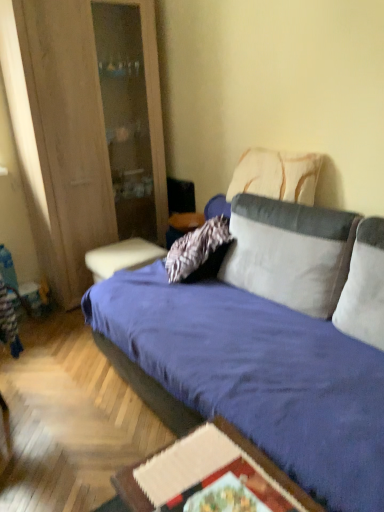
What do you see at coordinates (290, 252) in the screenshot? This screenshot has height=512, width=384. I see `velvety white pillow at center, the 2th pillow when ordered from front to back` at bounding box center [290, 252].

Where is `wooden textured table at lower center, the second table when ordered from back to front`? The image size is (384, 512). wooden textured table at lower center, the second table when ordered from back to front is located at coordinates pos(209,471).

This screenshot has width=384, height=512. What do you see at coordinates (364, 286) in the screenshot?
I see `white soft pillow at right, which is the first pillow from front to back` at bounding box center [364, 286].

The width and height of the screenshot is (384, 512). Describe the element at coordinates (80, 133) in the screenshot. I see `wooden cabinet at left` at that location.

What is the approximate width of velvet blue studio couch at center?

The width of velvet blue studio couch at center is 1.08 meters.

The width and height of the screenshot is (384, 512). Describe the element at coordinates (269, 345) in the screenshot. I see `velvet blue studio couch at center` at that location.

This screenshot has height=512, width=384. Identify the location of white textured pillow at upper right, the 1th pillow viewed from the back. (276, 176).

Where is `matte blue table at center, the second table when ordered from bottom to top`? Image resolution: width=384 pixels, height=512 pixels. matte blue table at center, the second table when ordered from bottom to top is located at coordinates (122, 257).

Which is closer to the camera, (x=244, y=247) or (x=163, y=469)?

The point (x=163, y=469) is in front.

In the scene shown: Are velvet blue studio couch at center and wooden textured table at lower center, the second table when ordered from back to front, located far from each other?

velvet blue studio couch at center is actually quite close to wooden textured table at lower center, the second table when ordered from back to front.

From the image's perspective, does velvet blue studio couch at center appear higher than wooden textured table at lower center, the first table from the front?

Indeed, from the image's perspective, velvet blue studio couch at center is shown above wooden textured table at lower center, the first table from the front.

Would you say wooden textured table at lower center, arranged as the first table when ordered from the bottom, is part of velvet blue studio couch at center's contents?

No, wooden textured table at lower center, arranged as the first table when ordered from the bottom, is located outside of velvet blue studio couch at center.

Who is taller, velvet blue studio couch at center or velvety white pillow at center, the 2th pillow when ordered from front to back?

velvet blue studio couch at center is taller.

From the image's perspective, is velvet blue studio couch at center beneath velvety white pillow at center, the 2th pillow when ordered from front to back?

Yes.

Relative to velvety white pillow at center, acting as the second pillow starting from the back, is velvet blue studio couch at center in front or behind?

velvet blue studio couch at center is in front of velvety white pillow at center, acting as the second pillow starting from the back.

Is velvet blue studio couch at center turned away from velvety white pillow at center, the 2th pillow when ordered from front to back?

That's right, velvet blue studio couch at center is facing away from velvety white pillow at center, the 2th pillow when ordered from front to back.

Which is behind, point (266, 165) or point (290, 269)?

The point (266, 165) is farther.

Can you confirm if white textured pillow at upper right, the 1th pillow viewed from the back, is positioned to the right of velvety white pillow at center, acting as the second pillow starting from the back?

In fact, white textured pillow at upper right, the 1th pillow viewed from the back, is to the left of velvety white pillow at center, acting as the second pillow starting from the back.

From their relative heights in the image, would you say white textured pillow at upper right, which ranks as the third pillow in front-to-back order, is taller or shorter than velvety white pillow at center, the 2th pillow when ordered from front to back?

In the image, white textured pillow at upper right, which ranks as the third pillow in front-to-back order, appears to be shorter than velvety white pillow at center, the 2th pillow when ordered from front to back.

Is white textured pillow at upper right, the 1th pillow viewed from the back, directly adjacent to velvety white pillow at center, the 2th pillow when ordered from front to back?

white textured pillow at upper right, the 1th pillow viewed from the back, and velvety white pillow at center, the 2th pillow when ordered from front to back, are clearly separated.

Based on the photo, does velvety white pillow at center, acting as the second pillow starting from the back, have a lesser width compared to velvet blue studio couch at center?

Indeed, velvety white pillow at center, acting as the second pillow starting from the back, has a lesser width compared to velvet blue studio couch at center.

Starting from the velvet blue studio couch at center, which pillow is the 2nd one behind? Please provide its 2D coordinates.

[(290, 252)]

Who is smaller, velvety white pillow at center, acting as the second pillow starting from the back, or velvet blue studio couch at center?

velvety white pillow at center, acting as the second pillow starting from the back, is smaller.

Which is in front, point (236, 241) or point (271, 439)?

Point (271, 439)

Is white soft pillow at right, which is the first pillow from front to back, not near velvety white pillow at center, acting as the second pillow starting from the back?

No.

Does white soft pillow at right, which is the first pillow from front to back, turn towards velvety white pillow at center, the 2th pillow when ordered from front to back?

No, white soft pillow at right, which is the first pillow from front to back, is not facing towards velvety white pillow at center, the 2th pillow when ordered from front to back.

Based on the photo, in terms of height, does white soft pillow at right, the 3th pillow positioned from the back, look taller or shorter compared to velvety white pillow at center, the 2th pillow when ordered from front to back?

Considering their sizes, white soft pillow at right, the 3th pillow positioned from the back, has less height than velvety white pillow at center, the 2th pillow when ordered from front to back.

Is wooden cabinet at left not close to velvety white pillow at center, acting as the second pillow starting from the back?

Absolutely, wooden cabinet at left is distant from velvety white pillow at center, acting as the second pillow starting from the back.

Is wooden cabinet at left situated inside velvety white pillow at center, the 2th pillow when ordered from front to back, or outside?

wooden cabinet at left is located beyond the bounds of velvety white pillow at center, the 2th pillow when ordered from front to back.

From the image's perspective, who appears lower, wooden cabinet at left or velvety white pillow at center, the 2th pillow when ordered from front to back?

velvety white pillow at center, the 2th pillow when ordered from front to back, from the image's perspective.

Considering the relative positions of wooden cabinet at left and velvety white pillow at center, the 2th pillow when ordered from front to back, in the image provided, is wooden cabinet at left to the left of velvety white pillow at center, the 2th pillow when ordered from front to back, from the viewer's perspective?

Yes, wooden cabinet at left is to the left of velvety white pillow at center, the 2th pillow when ordered from front to back.

From a real-world perspective, which object stands above the other?

From a 3D spatial view, white textured pillow at upper right, the 1th pillow viewed from the back, is above.

From the image's perspective, is matte blue table at center, the second table when ordered from bottom to top, on white textured pillow at upper right, which ranks as the third pillow in front-to-back order?

Incorrect, from the image's perspective, matte blue table at center, the second table when ordered from bottom to top, is lower than white textured pillow at upper right, which ranks as the third pillow in front-to-back order.

Can you confirm if matte blue table at center, positioned as the 2th table in right-to-left order, is thinner than white textured pillow at upper right, the 1th pillow viewed from the back?

Incorrect, the width of matte blue table at center, positioned as the 2th table in right-to-left order, is not less than that of white textured pillow at upper right, the 1th pillow viewed from the back.

From the white textured pillow at upper right, the 1th pillow viewed from the back, count the 2nd table to the left and point to it. Please provide its 2D coordinates.

[(122, 257)]

Where is `studio couch on the right of wooden textured table at lower center, the second table when ordered from back to front`? The image size is (384, 512). studio couch on the right of wooden textured table at lower center, the second table when ordered from back to front is located at coordinates (269, 345).

This screenshot has height=512, width=384. In order to click on studio couch beneath the velvety white pillow at center, acting as the second pillow starting from the back (from a real-world perspective) in this screenshot , I will do `click(269, 345)`.

Considering their positions, is velvety white pillow at center, the 2th pillow when ordered from front to back, positioned closer to white soft pillow at right, the 3th pillow positioned from the back, than wooden textured table at lower center, the first table from the front?

velvety white pillow at center, the 2th pillow when ordered from front to back, is positioned closer to the anchor white soft pillow at right, the 3th pillow positioned from the back.

When comparing their distances from velvety white pillow at center, the 2th pillow when ordered from front to back, does wooden cabinet at left or wooden textured table at lower center, the first table from the front, seem closer?

wooden textured table at lower center, the first table from the front, is positioned closer to the anchor velvety white pillow at center, the 2th pillow when ordered from front to back.

Considering their positions, is wooden textured table at lower center, arranged as the first table when viewed from the right, positioned closer to wooden cabinet at left than white soft pillow at right, which is the first pillow from front to back?

white soft pillow at right, which is the first pillow from front to back.

When comparing their distances from white textured pillow at upper right, the 1th pillow viewed from the back, does wooden cabinet at left or velvet blue studio couch at center seem further?

Based on the image, wooden cabinet at left appears to be further to white textured pillow at upper right, the 1th pillow viewed from the back.

Based on their spatial positions, is white textured pillow at upper right, which ranks as the third pillow in front-to-back order, or matte blue table at center, positioned as the 2th table in right-to-left order, further from wooden textured table at lower center, arranged as the first table when viewed from the right?

matte blue table at center, positioned as the 2th table in right-to-left order, is further to wooden textured table at lower center, arranged as the first table when viewed from the right.

Estimate the real-world distances between objects in this image. Which object is further from wooden textured table at lower center, the second table when ordered from back to front, wooden cabinet at left or matte blue table at center, the second table when ordered from bottom to top?

wooden cabinet at left is positioned further to the anchor wooden textured table at lower center, the second table when ordered from back to front.

Estimate the real-world distances between objects in this image. Which object is further from white textured pillow at upper right, the 1th pillow viewed from the back, matte blue table at center, which ranks as the first table in back-to-front order, or velvet blue studio couch at center?

matte blue table at center, which ranks as the first table in back-to-front order, lies further to white textured pillow at upper right, the 1th pillow viewed from the back, than the other object.

Considering their positions, is wooden cabinet at left positioned further to white soft pillow at right, which is the first pillow from front to back, than white textured pillow at upper right, the 1th pillow viewed from the back?

wooden cabinet at left is further to white soft pillow at right, which is the first pillow from front to back.

Image resolution: width=384 pixels, height=512 pixels. Identify the location of pillow situated between matte blue table at center, which is the 1th table from left to right, and velvety white pillow at center, acting as the second pillow starting from the back, from left to right. (276, 176).

Locate an element on the screen. The height and width of the screenshot is (512, 384). pillow located between wooden cabinet at left and velvety white pillow at center, acting as the second pillow starting from the back, in the left-right direction is located at coordinates (276, 176).

At what (x,y) coordinates should I click in order to perform the action: click on table located between velvet blue studio couch at center and wooden cabinet at left in the depth direction. Please return your answer as a coordinate pair (x, y). This screenshot has width=384, height=512. Looking at the image, I should click on (209, 471).

Find the location of a particular element. table between velvet blue studio couch at center and white soft pillow at right, the 3th pillow positioned from the back, in the front-back direction is located at coordinates (209, 471).